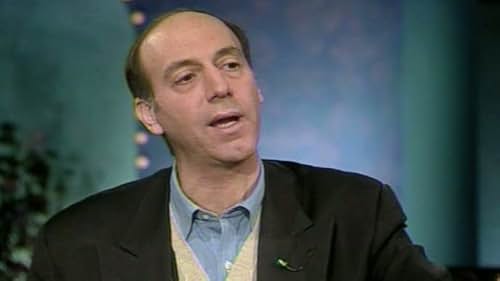
The image size is (500, 281). What are the coordinates of `column` in the screenshot? It's located at (452, 140).